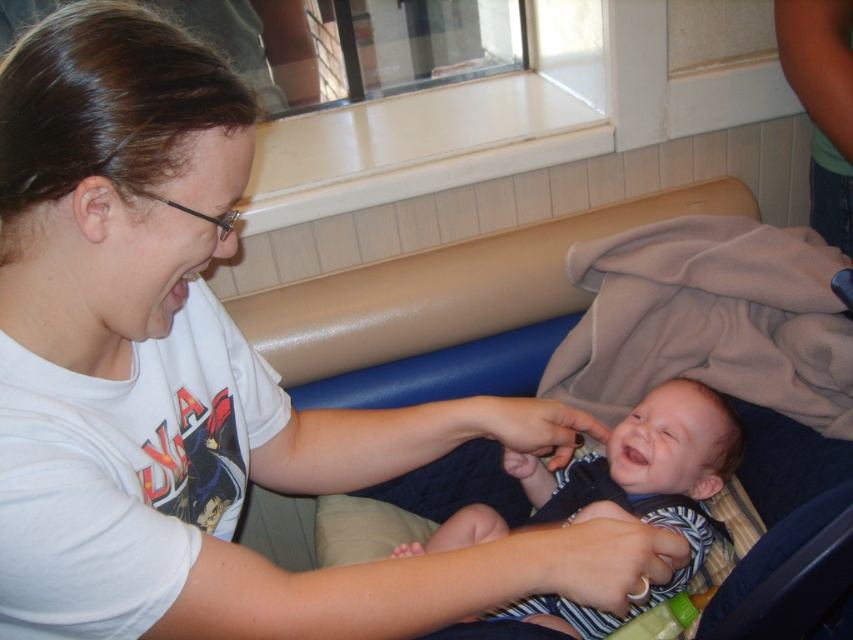
You are a restaurant employee who needs to move a dark blue fabric baby carriage at center and a striped fabric baby at center from the booth to the entrance. The path is narrow. Which object should you move first to ensure the narrow path is not blocked?

The striped fabric baby at center is narrower than the dark blue fabric baby carriage at center, so you should move the striped fabric baby at center first to avoid blocking the narrow path.

You are a photographer trying to capture a candid shot of the striped fabric baby at center and the dark blue fabric baby carriage at center. Since you want to focus on the baby, which object should you adjust your camera focus to prioritize?

The striped fabric baby at center should be prioritized in focus because it is closer to the viewer than the dark blue fabric baby carriage at center, which is further away.

In the scene described, there is a dark blue fabric baby carriage at center and a striped fabric baby at center. Which object takes up more space in the image?

The dark blue fabric baby carriage at center is larger in size than the striped fabric baby at center, so it takes up more space in the image.